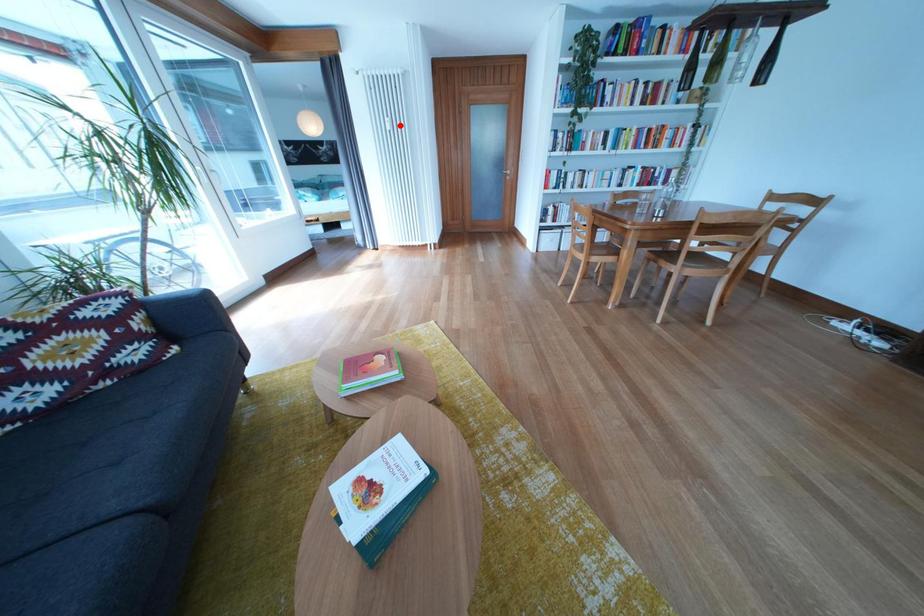
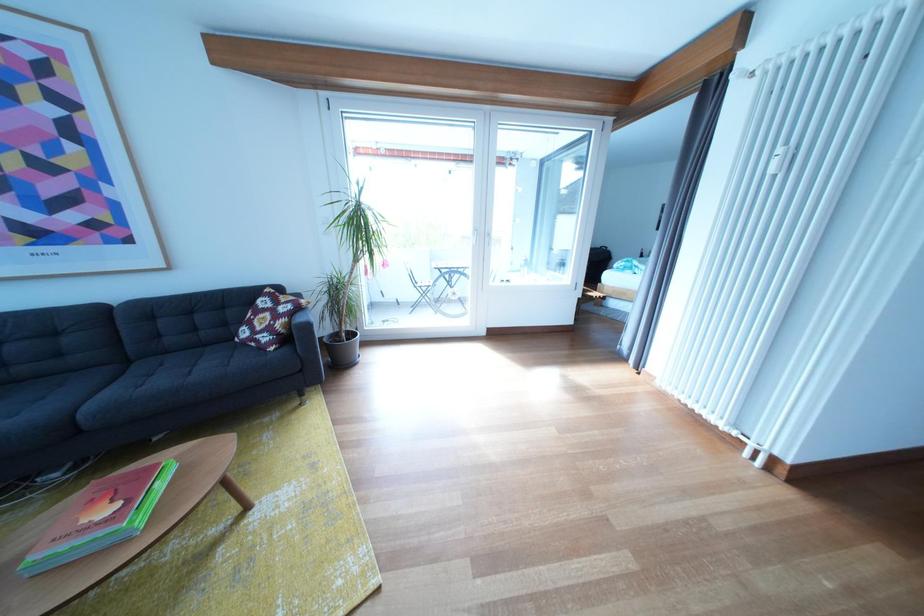
The point at the highlighted location is marked in the first image. Where is the corresponding point in the second image?

(793, 156)